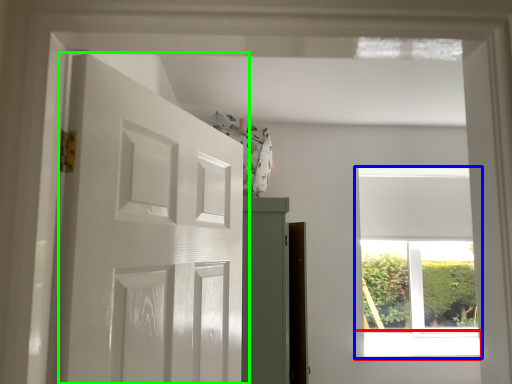
Question: Estimate the real-world distances between objects in this image. Which object is closer to window sill (highlighted by a red box), window (highlighted by a blue box) or door (highlighted by a green box)?

Choices:
 (A) window
 (B) door

Answer: (A)